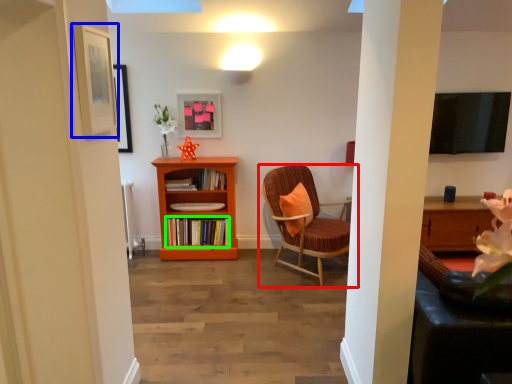
Question: Which object is the closest to the chair (highlighted by a red box)? Choose among these: picture frame (highlighted by a blue box) or book (highlighted by a green box).

Choices:
 (A) picture frame
 (B) book

Answer: (B)